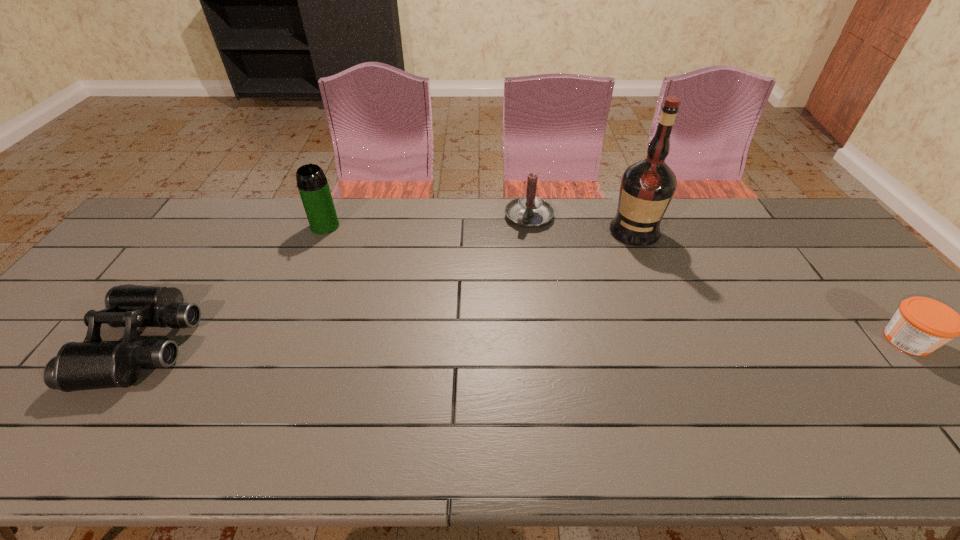
Identify the location of vacant space in between the fourth object from right to left and the binoculars. (234, 285).

Where is `vacant point located between the tallest object and the leftmost object`? The height and width of the screenshot is (540, 960). vacant point located between the tallest object and the leftmost object is located at coordinates (389, 288).

This screenshot has height=540, width=960. I want to click on the second closest object to the fourth shortest object, so click(x=528, y=211).

You are a GUI agent. You are given a task and a screenshot of the screen. Output one action in this format:
    pyautogui.click(x=<x>, y=<y>)
    Task: Click on the object that stands as the second closest to the leftmost object
    This screenshot has height=540, width=960.
    Given the screenshot: What is the action you would take?
    pyautogui.click(x=528, y=211)

Find the location of a particular element. The image size is (960, 540). vacant region that satisfies the following two spatial constraints: 1. on the back side of the thermos bottle; 2. on the left side of the third object from right to left is located at coordinates (328, 218).

I want to click on free spot that satisfies the following two spatial constraints: 1. on the front side of the rightmost object; 2. on the front label of the fourth object from left to right, so click(678, 340).